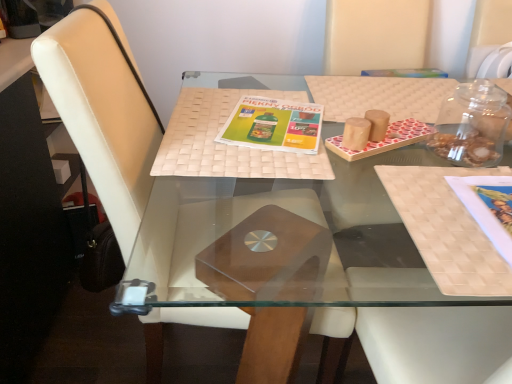
Find the location of a particular element. The width and height of the screenshot is (512, 384). vacant area on top of green matte magazine at center, arranged as the 2th book cover when ordered from the bottom (from a real-world perspective) is located at coordinates (270, 120).